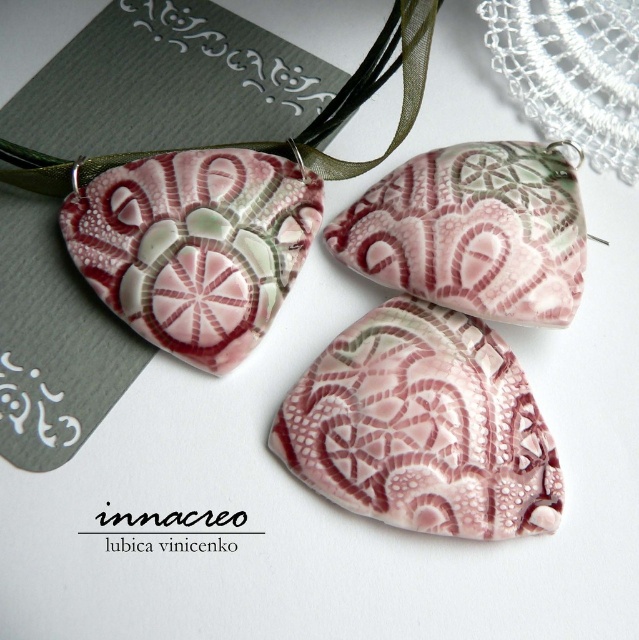
Question: Is pink lace-like pendant at center further to the viewer compared to matte black card at upper center?

Choices:
 (A) yes
 (B) no

Answer: (B)

Question: Which of the following is the farthest from the observer?

Choices:
 (A) (190, 3)
 (B) (468, 502)

Answer: (A)

Question: Which object is positioned closest to the pink lace at upper left?

Choices:
 (A) pink porcelain pendant at center
 (B) matte black card at upper center
 (C) pink glossy pendant at center

Answer: (A)

Question: Does pink lace-like pendant at center appear on the right side of pink lace at upper left?

Choices:
 (A) yes
 (B) no

Answer: (A)

Question: Does pink porcelain pendant at center come behind white lace doily at upper right?

Choices:
 (A) yes
 (B) no

Answer: (B)

Question: Among these points, which one is nearest to the camera?

Choices:
 (A) (54, 394)
 (B) (581, 80)
 (C) (247, 106)

Answer: (A)